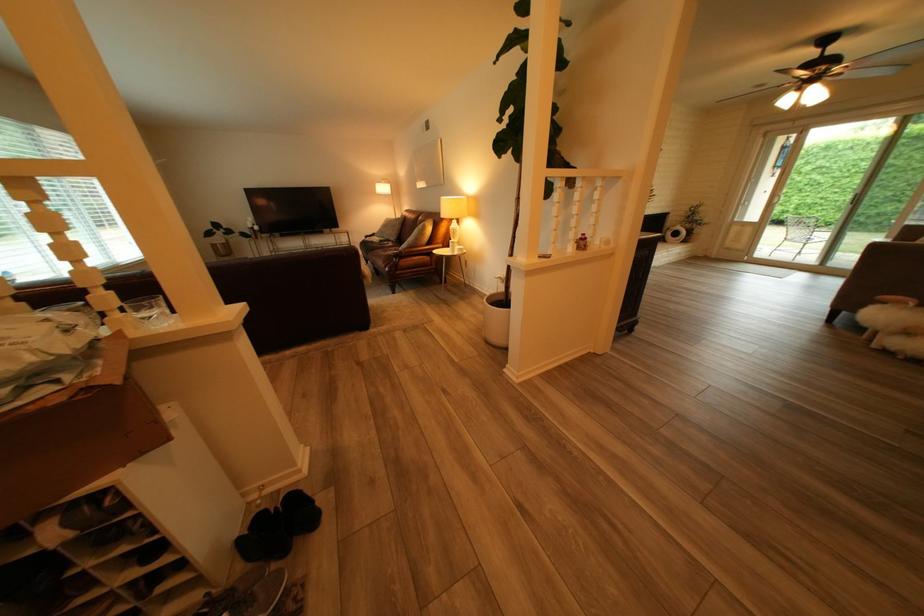
Find where to sit the outdoor chair sitting surface. Please return your answer as a coordinate pair (x, y).

(805, 232)